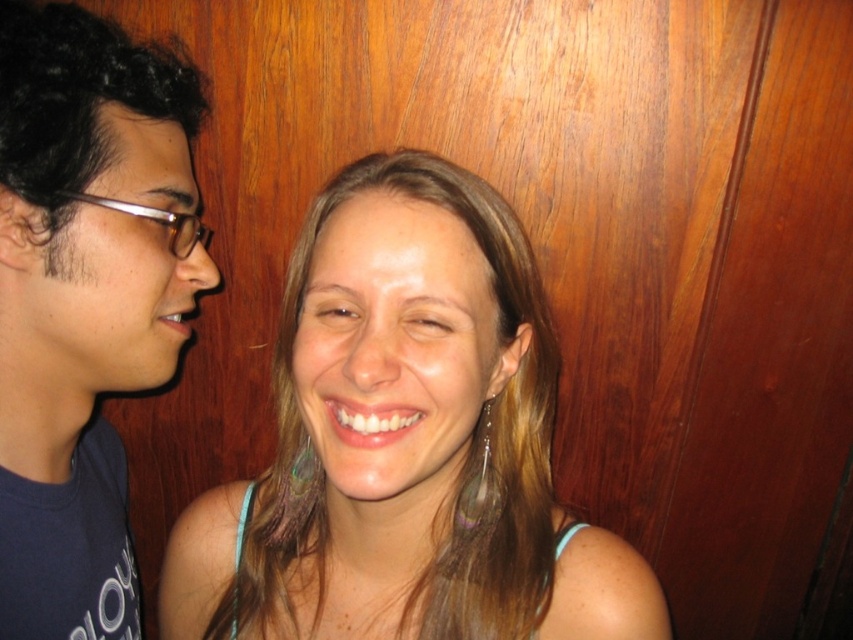
Is matte skin face at center wider than dark blue t-shirt at left?

Yes, matte skin face at center is wider than dark blue t-shirt at left.

Can you confirm if matte skin face at center is shorter than dark blue t-shirt at left?

Yes, matte skin face at center is shorter than dark blue t-shirt at left.

Is point (440, 532) positioned after point (135, 49)?

No, it is not.

Where is `matte skin face at center`? Image resolution: width=853 pixels, height=640 pixels. matte skin face at center is located at coordinates (405, 442).